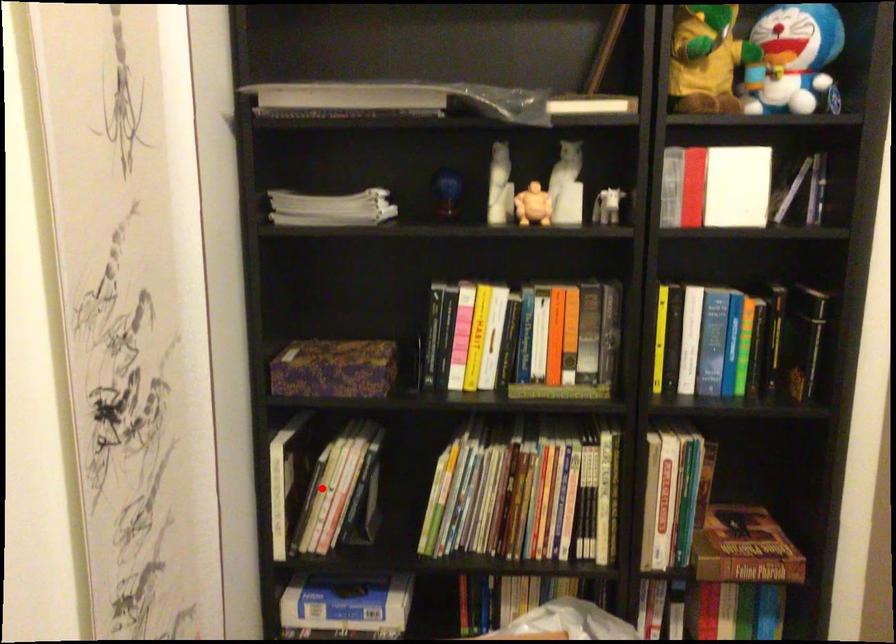
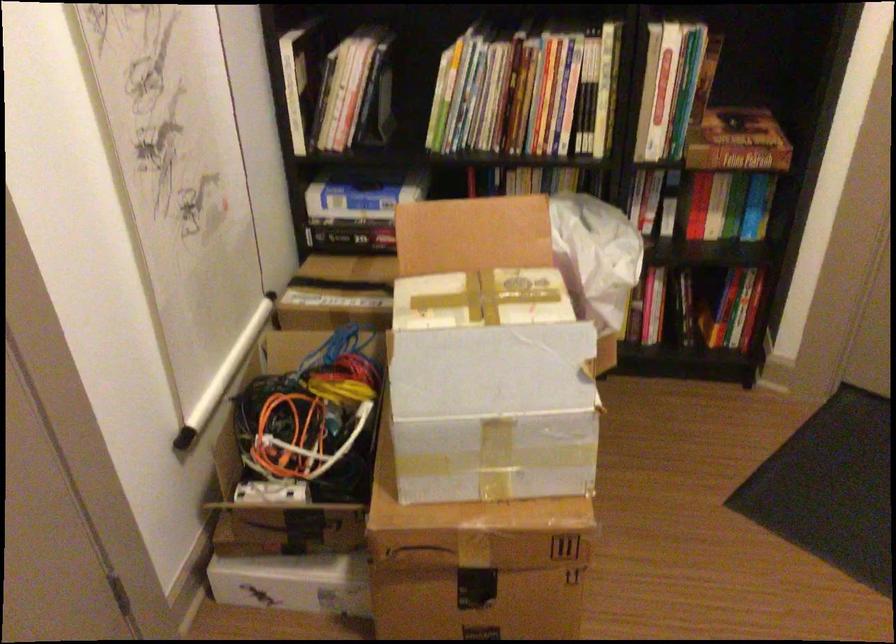
Where in the second image is the point corresponding to the highlighted location from the first image?

(334, 86)